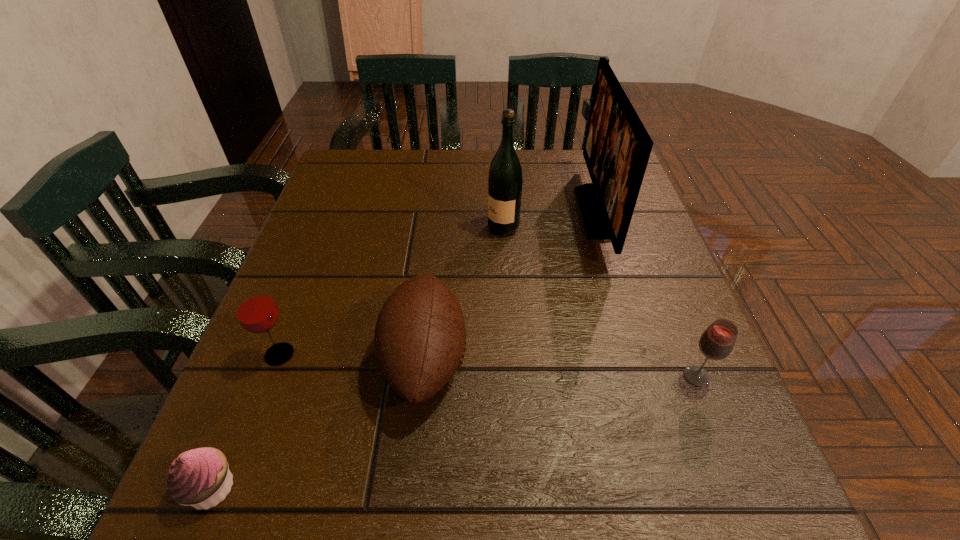
Identify which object is the third nearest to the taller glass drink container. Please provide its 2D coordinates. Your answer should be formatted as a tuple, i.e. [(x, y)], where the tuple contains the x and y coordinates of a point satisfying the conditions above.

[(505, 179)]

Where is `vacant space that satisfies the following two spatial constraints: 1. on the back side of the rightmost object; 2. on the front-facing side of the liquor`? vacant space that satisfies the following two spatial constraints: 1. on the back side of the rightmost object; 2. on the front-facing side of the liquor is located at coordinates (636, 228).

At what (x,y) coordinates should I click in order to perform the action: click on free spot that satisfies the following two spatial constraints: 1. on the front-facing side of the liquor; 2. on the right side of the right glass drink container. Please return your answer as a coordinate pair (x, y). Looking at the image, I should click on (512, 376).

This screenshot has height=540, width=960. Find the location of `free space that satisfies the following two spatial constraints: 1. on the front-facing side of the right glass drink container; 2. on the left side of the liquor`. free space that satisfies the following two spatial constraints: 1. on the front-facing side of the right glass drink container; 2. on the left side of the liquor is located at coordinates (512, 376).

I want to click on free spot that satisfies the following two spatial constraints: 1. on the front-facing side of the fourth object from left to right; 2. on the front side of the left glass drink container, so click(511, 355).